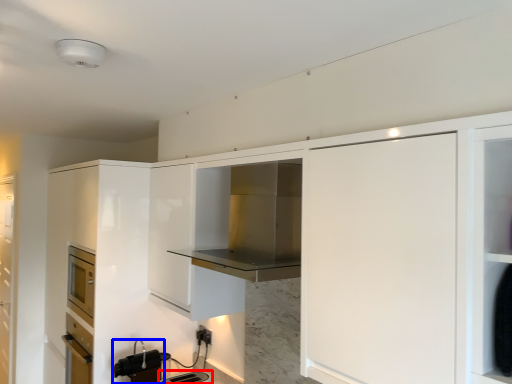
Question: Among these objects, which one is farthest to the camera, appliance (highlighted by a red box) or appliance (highlighted by a blue box)?

Choices:
 (A) appliance
 (B) appliance

Answer: (B)